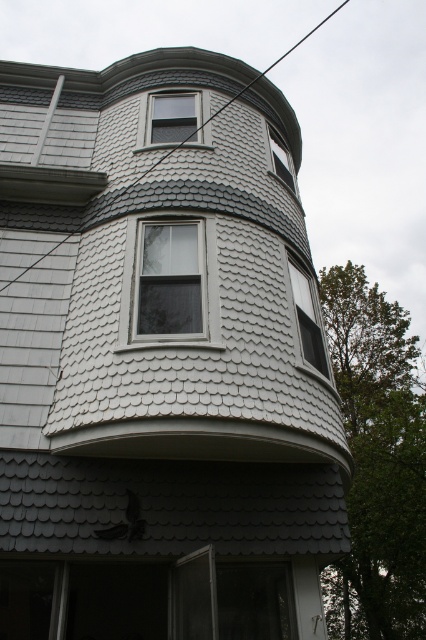
Is clear glass window at upper center smaller than black wire at upper center?

Indeed, clear glass window at upper center has a smaller size compared to black wire at upper center.

How far apart are clear glass window at upper center and black wire at upper center?

The distance of clear glass window at upper center from black wire at upper center is 1.85 meters.

You are a GUI agent. You are given a task and a screenshot of the screen. Output one action in this format:
    pyautogui.click(x=<x>, y=<y>)
    Task: Click on the clear glass window at upper center
    This screenshot has width=426, height=640.
    Given the screenshot: What is the action you would take?
    pyautogui.click(x=172, y=116)

Find the location of a particular element. The image size is (426, 640). clear glass window at upper center is located at coordinates (172, 116).

Between point (138, 227) and point (209, 118), which one is positioned in front?

Point (138, 227) is more forward.

Can you confirm if white wood window at center is positioned above black wire at upper center?

No, white wood window at center is not above black wire at upper center.

Is point (170, 314) positioned before point (31, 266)?

Yes, point (170, 314) is closer to viewer.

This screenshot has width=426, height=640. Identify the location of white wood window at center. (169, 284).

Which is in front, point (324, 365) or point (141, 177)?

Point (324, 365) is more forward.

Does clear glass window at center appear on the left side of black wire at upper center?

Correct, you'll find clear glass window at center to the left of black wire at upper center.

Who is more distant from viewer, (310, 330) or (241, 90)?

The point (241, 90) is more distant.

Image resolution: width=426 pixels, height=640 pixels. I want to click on clear glass window at center, so click(307, 321).